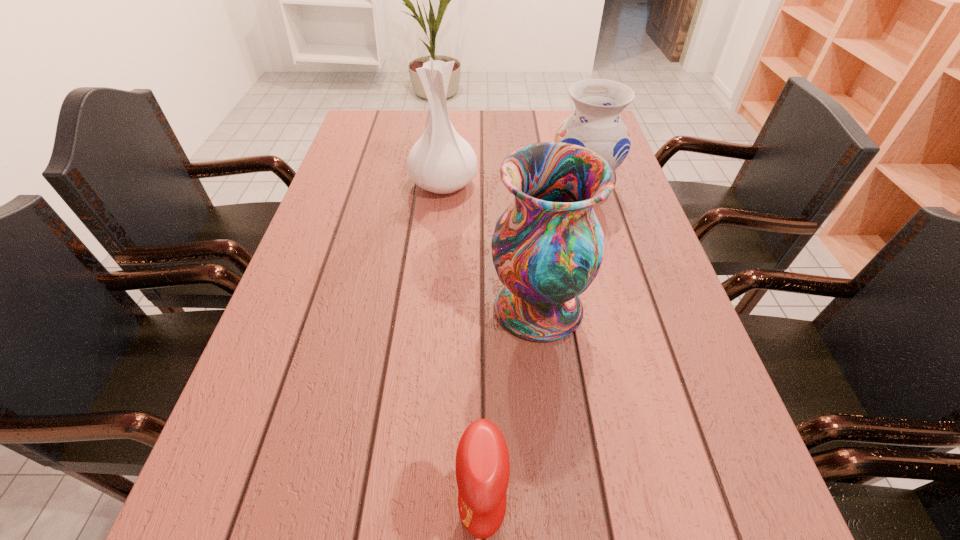
Find the location of `the second nearest object`. the second nearest object is located at coordinates (547, 248).

At what (x,y) coordinates should I click in order to perform the action: click on the leftmost vase. Please return your answer as a coordinate pair (x, y). The width and height of the screenshot is (960, 540). Looking at the image, I should click on (441, 161).

The width and height of the screenshot is (960, 540). Identify the location of the shortest vase. (596, 124).

This screenshot has width=960, height=540. I want to click on free space located on the left of the nearest vase, so click(336, 307).

Locate an element on the screen. blank space located 0.120m on the front of the leftmost vase is located at coordinates (439, 234).

Image resolution: width=960 pixels, height=540 pixels. In order to click on vacant space located 0.160m on the left of the shortest vase in this screenshot , I will do `click(491, 189)`.

I want to click on object that is at the right edge, so click(x=596, y=124).

I want to click on vacant space at the far edge, so click(468, 110).

In order to click on vacant space at the left edge of the desktop in this screenshot , I will do `click(306, 434)`.

Where is `free space at the far left corner`? Image resolution: width=960 pixels, height=540 pixels. free space at the far left corner is located at coordinates (383, 142).